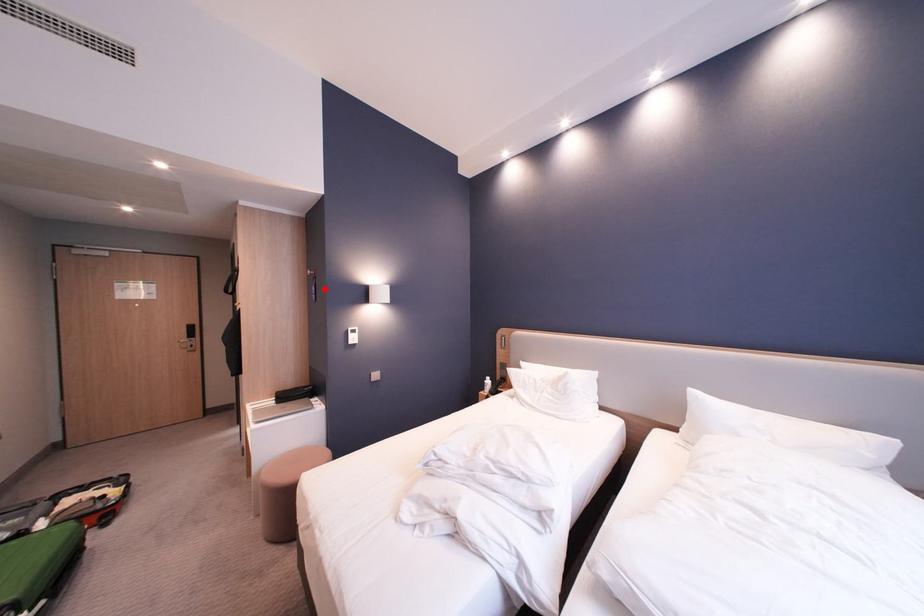
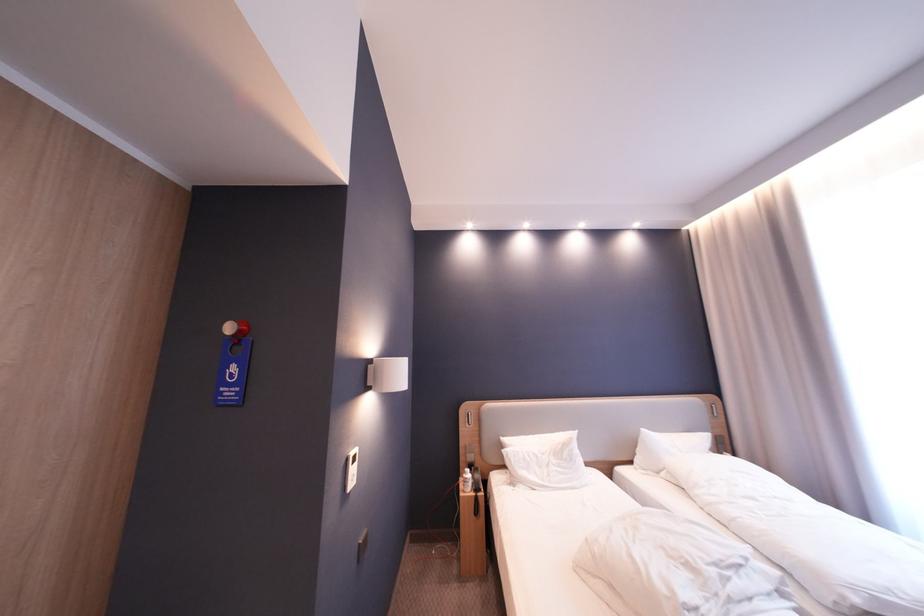
Where in the second image is the point corresponding to the highlighted location from the first image?

(245, 370)